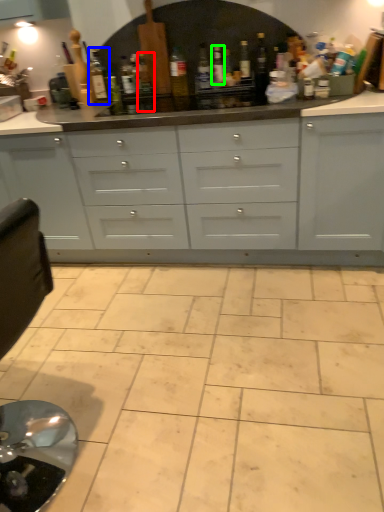
Question: Based on their relative distances, which object is farther from bottle (highlighted by a red box)? Choose from bottle (highlighted by a blue box) and bottle (highlighted by a green box).

Choices:
 (A) bottle
 (B) bottle

Answer: (B)